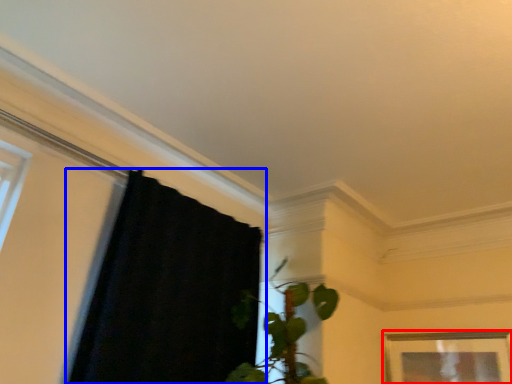
Question: Which object appears farthest to the camera in this image, picture frame (highlighted by a red box) or curtain (highlighted by a blue box)?

Choices:
 (A) picture frame
 (B) curtain

Answer: (A)